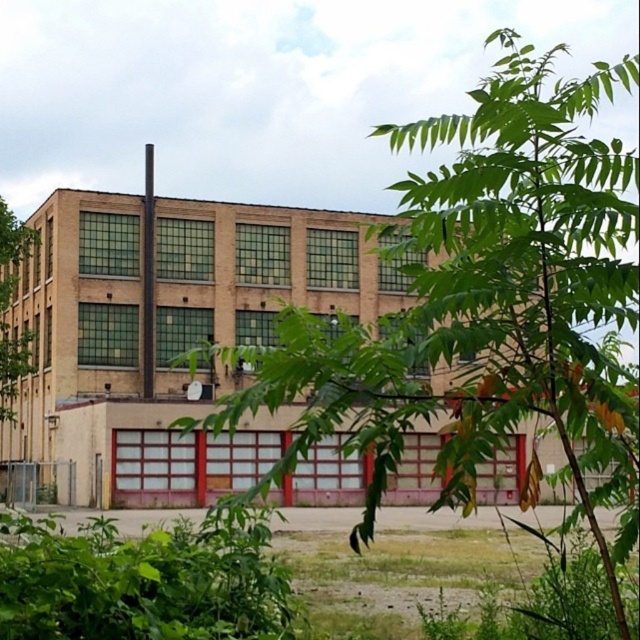
Question: Which of the following is the closest to the observer?

Choices:
 (A) (8, 406)
 (B) (243, 636)
 (C) (243, 284)
 (D) (547, 314)

Answer: (D)

Question: Observing the image, what is the correct spatial positioning of brick building at center in reference to green leafy tree at left?

Choices:
 (A) above
 (B) below

Answer: (B)

Question: Where is green leafy plant at lower left located in relation to green leafy tree at left in the image?

Choices:
 (A) left
 (B) right

Answer: (B)

Question: Can you confirm if green leafy tree at center is wider than green leafy tree at left?

Choices:
 (A) yes
 (B) no

Answer: (A)

Question: Estimate the real-world distances between objects in this image. Which object is farther from the green leafy tree at left?

Choices:
 (A) brick building at center
 (B) green leafy tree at center

Answer: (B)

Question: Which object is closer to the camera taking this photo?

Choices:
 (A) green leafy plant at lower left
 (B) green leafy tree at center
 (C) brick building at center
 (D) green leafy tree at left

Answer: (A)